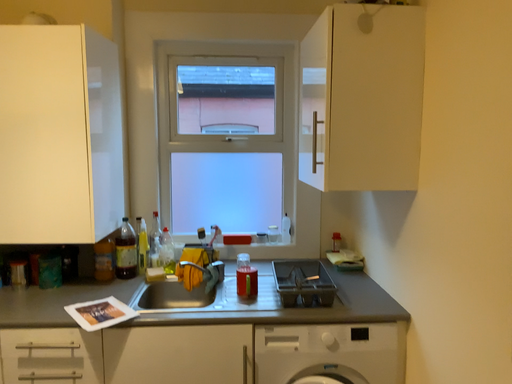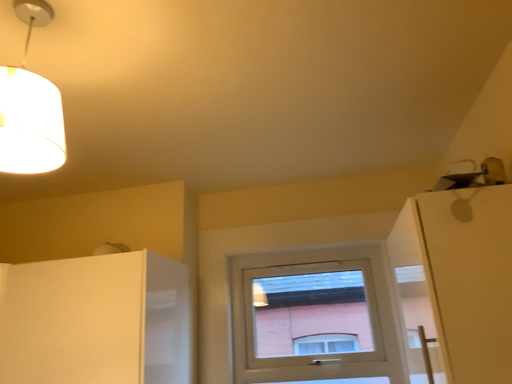
Question: How did the camera likely rotate when shooting the video?

Choices:
 (A) rotated left
 (B) rotated right

Answer: (A)